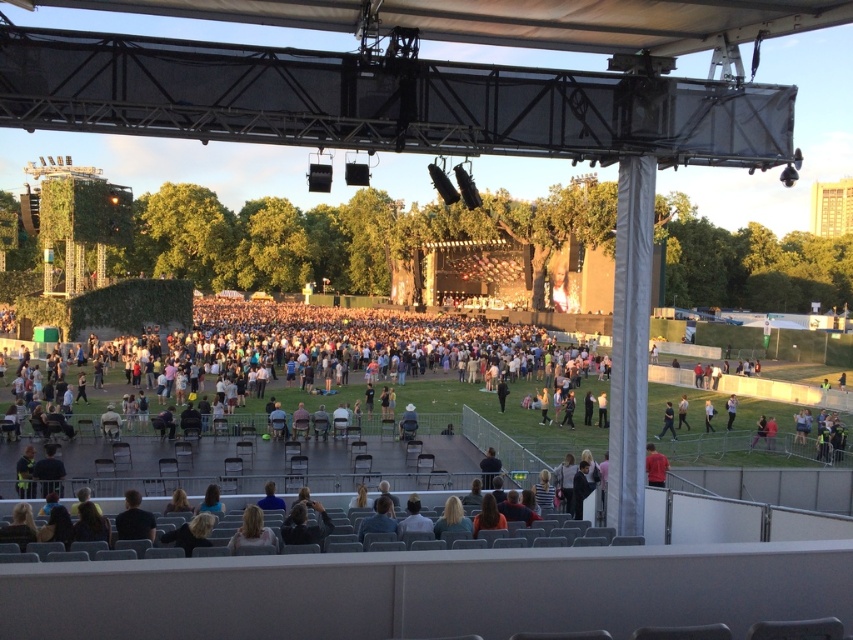
Does red shirt at center have a larger size compared to black fabric pants at lower right?

Correct, red shirt at center is larger in size than black fabric pants at lower right.

Between point (656, 476) and point (659, 435), which one is positioned in front?

Point (656, 476) is in front.

Is point (660, 461) positioned behind point (668, 413)?

No, (660, 461) is in front of (668, 413).

The height and width of the screenshot is (640, 853). Identify the location of red shirt at center. (654, 467).